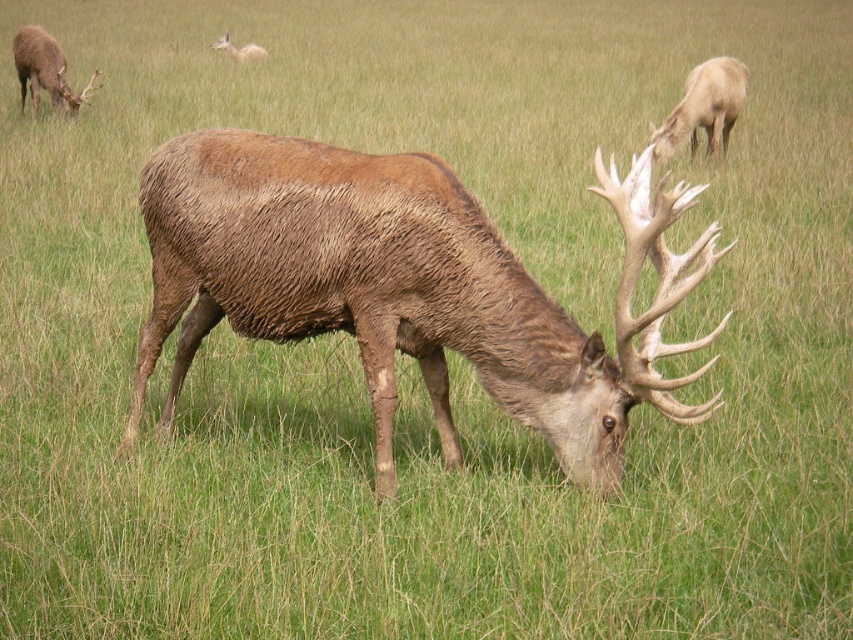
Is point (450, 454) positioned before point (676, 116)?

Yes.

Who is positioned more to the left, brown furry deer at center or light brown fur at upper right?

brown furry deer at center

Is point (590, 369) closer to camera compared to point (701, 88)?

Yes, point (590, 369) is closer to viewer.

In order to click on brown furry deer at center in this screenshot , I will do `click(402, 288)`.

Is the position of light brown fur at upper right less distant than that of brown velvet deer at upper left?

Yes, it is in front of brown velvet deer at upper left.

Does light brown fur at upper right appear on the right side of brown velvet deer at upper left?

Correct, you'll find light brown fur at upper right to the right of brown velvet deer at upper left.

Which is in front, point (715, 67) or point (22, 40)?

Point (715, 67)

Where is `light brown fur at upper right`? The height and width of the screenshot is (640, 853). light brown fur at upper right is located at coordinates (703, 108).

Which is behind, point (375, 413) or point (32, 84)?

The point (32, 84) is behind.

Consider the image. Who is positioned more to the left, brown furry deer at center or brown velvet deer at upper left?

brown velvet deer at upper left

Does point (549, 444) come behind point (65, 93)?

No.

The image size is (853, 640). What are the coordinates of `brown furry deer at center` in the screenshot? It's located at (402, 288).